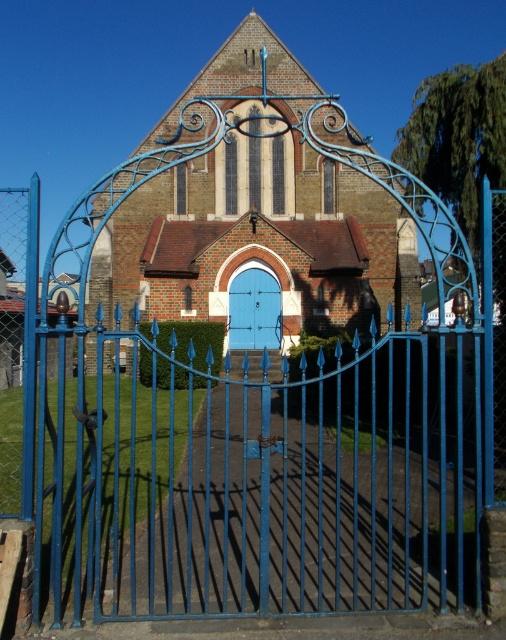
You are a delivery person trying to bring a large package through the entrance of the church. The package is 2 meters wide. The entrance has both the blue metal gate at center and the blue matte door at center. Which entrance should you use to ensure the package can pass through?

The blue metal gate at center has a larger width than the blue matte door at center, so you should use the blue metal gate at center to pass through the package since it can accommodate the 2 meters width.

You are visiting a church and want to enter through the blue metal gate at center. From your current position in front of the brick church at center, which direction should you walk to reach the gate?

The blue metal gate at center is positioned on the right side of brick church at center, so you should walk towards the right side of the brick church at center to reach the gate.